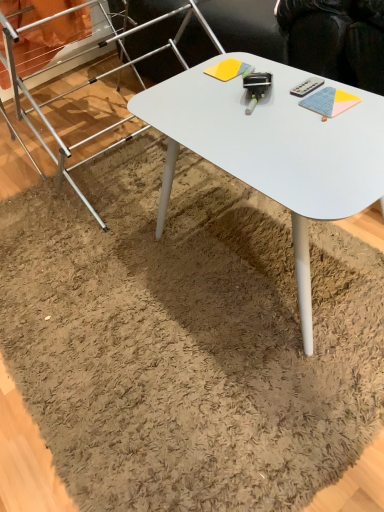
Locate an element on the screen. This screenshot has height=512, width=384. free space between black plastic remote control at upper right and yellow matte notepad at center, the first notepad when ordered from back to front is located at coordinates (269, 78).